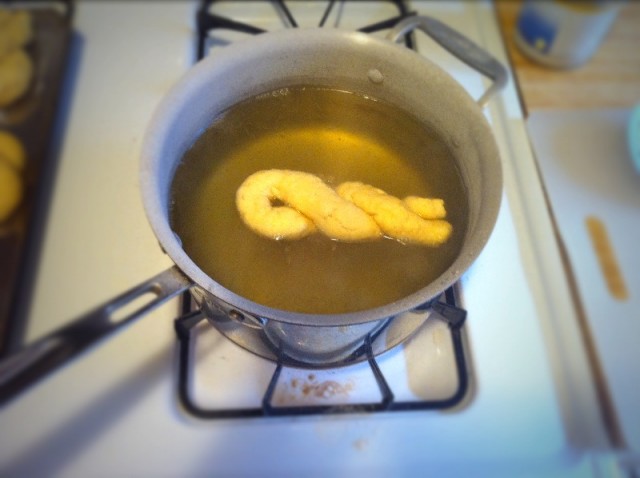
Where is `cutting board`? cutting board is located at coordinates (589, 166).